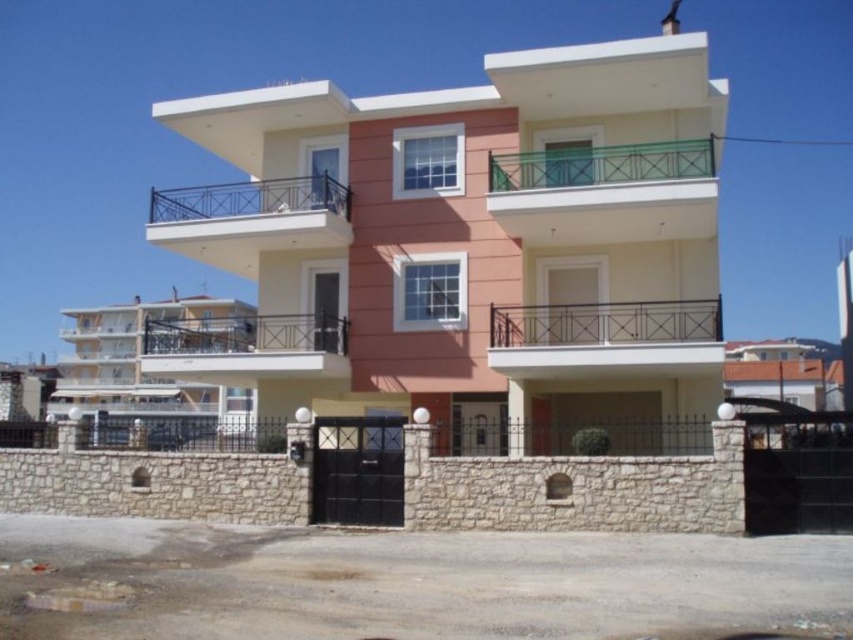
Question: Estimate the real-world distances between objects in this image. Which object is farther from the black metal railing at upper center?

Choices:
 (A) white wrought iron balcony at center
 (B) white matte balcony at center
 (C) green metal railing at upper center

Answer: (B)

Question: Which object is closer to the camera taking this photo?

Choices:
 (A) white wrought iron balcony at center
 (B) black metal railing at upper center

Answer: (A)

Question: Which object is farther from the camera taking this photo?

Choices:
 (A) white matte balcony at center
 (B) green metal railing at upper center
 (C) white wrought iron balcony at center
 (D) black metal railing at upper center

Answer: (D)

Question: Can you confirm if white wrought iron balcony at center is positioned to the right of black metal railing at upper center?

Choices:
 (A) no
 (B) yes

Answer: (B)

Question: Is green metal railing at upper center below black metal railing at upper center?

Choices:
 (A) yes
 (B) no

Answer: (A)

Question: Is green metal railing at upper center thinner than black metal railing at upper center?

Choices:
 (A) no
 (B) yes

Answer: (B)